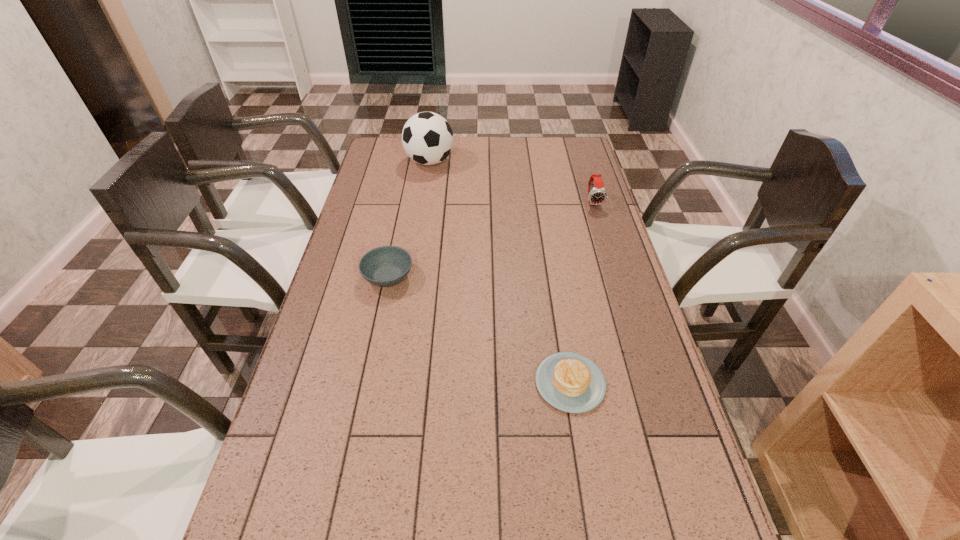
Identify the location of empty space that is in between the nearest object and the tallest object. This screenshot has height=540, width=960. (500, 272).

Locate an element on the screen. This screenshot has height=540, width=960. vacant area that lies between the farthest object and the third nearest object is located at coordinates (512, 182).

At what (x,y) coordinates should I click in order to perform the action: click on object that is the closest to the second shortest object. Please return your answer as a coordinate pair (x, y). The image size is (960, 540). Looking at the image, I should click on (570, 382).

Where is `object that is the third nearest to the third tallest object`? object that is the third nearest to the third tallest object is located at coordinates (597, 195).

At what (x,y) coordinates should I click in order to perform the action: click on vacant space that satisfies the following two spatial constraints: 1. on the front side of the tallest object; 2. on the left side of the third object from left to right. Please return your answer as a coordinate pair (x, y). Looking at the image, I should click on (396, 383).

I want to click on vacant space that satisfies the following two spatial constraints: 1. on the front side of the nearest object; 2. on the left side of the second nearest object, so [x=366, y=383].

Where is `vacant space that satisfies the following two spatial constraints: 1. on the front side of the soccer ball; 2. on the right side of the second object from right to left`? vacant space that satisfies the following two spatial constraints: 1. on the front side of the soccer ball; 2. on the right side of the second object from right to left is located at coordinates (396, 383).

Locate an element on the screen. free space that satisfies the following two spatial constraints: 1. on the front side of the third object from left to right; 2. on the left side of the soccer ball is located at coordinates (396, 383).

Where is `vacant area that satisfies the following two spatial constraints: 1. on the front side of the soup bowl; 2. on the right side of the nearest object`? This screenshot has height=540, width=960. vacant area that satisfies the following two spatial constraints: 1. on the front side of the soup bowl; 2. on the right side of the nearest object is located at coordinates (366, 383).

Identify the location of free space that satisfies the following two spatial constraints: 1. on the front side of the nearest object; 2. on the left side of the third farthest object. The height and width of the screenshot is (540, 960). (366, 383).